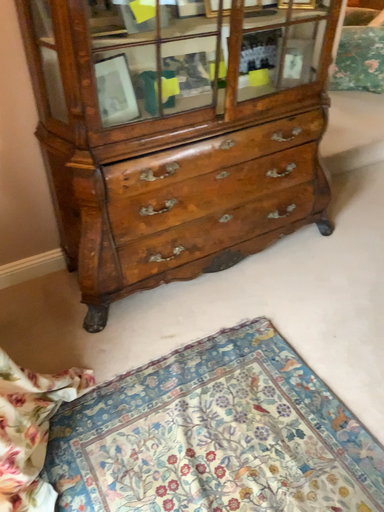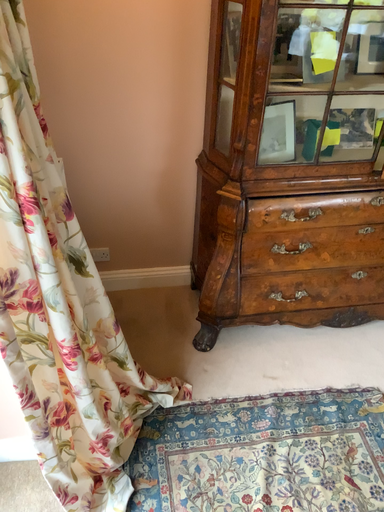
Question: Which way did the camera rotate in the video?

Choices:
 (A) rotated downward
 (B) rotated upward

Answer: (B)